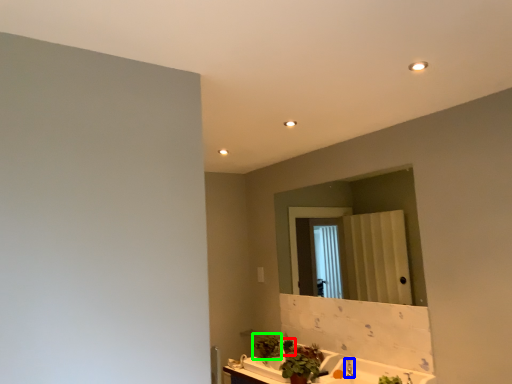
Question: Considering the real-world distances, which object is closest to plant (highlighted by a red box)? faucet (highlighted by a blue box) or plant (highlighted by a green box).

Choices:
 (A) faucet
 (B) plant

Answer: (B)